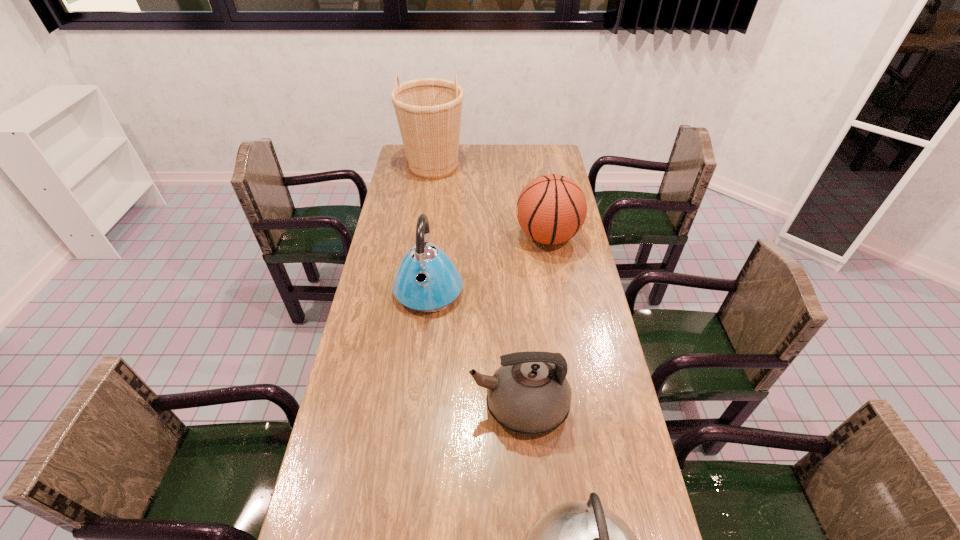
I want to click on blank area located 0.350m on the side where the inflation valve is located, so click(425, 237).

Locate an element on the screen. The image size is (960, 540). vacant space situated at the spout of the second nearest object is located at coordinates (376, 406).

Where is `vacant region located 0.160m at the spout of the second nearest object`? This screenshot has height=540, width=960. vacant region located 0.160m at the spout of the second nearest object is located at coordinates (413, 406).

Locate an element on the screen. vacant space located 0.340m at the spout of the second nearest object is located at coordinates (348, 406).

Where is `object that is positioned at the far edge`? object that is positioned at the far edge is located at coordinates (428, 110).

I want to click on basket that is at the left edge, so click(x=428, y=110).

Identify the location of kettle that is positioned at the left edge. (427, 280).

At what (x,y) coordinates should I click in order to perform the action: click on basketball at the right edge. Please return your answer as a coordinate pair (x, y). The height and width of the screenshot is (540, 960). Looking at the image, I should click on (551, 209).

This screenshot has width=960, height=540. Identify the location of kettle at the right edge. (529, 394).

This screenshot has width=960, height=540. In order to click on object that is at the far left corner in this screenshot , I will do `click(428, 110)`.